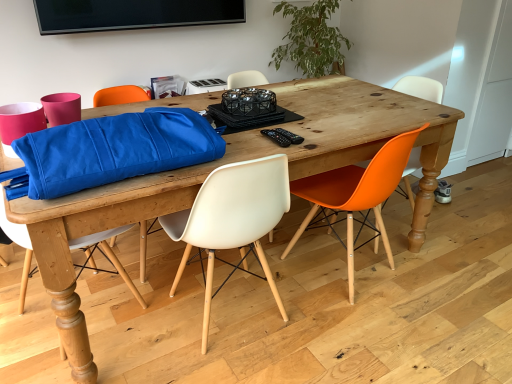
What are the coordinates of `free space behind black plastic remote control at center, the first remote control when ordered from right to left` in the screenshot? It's located at (288, 124).